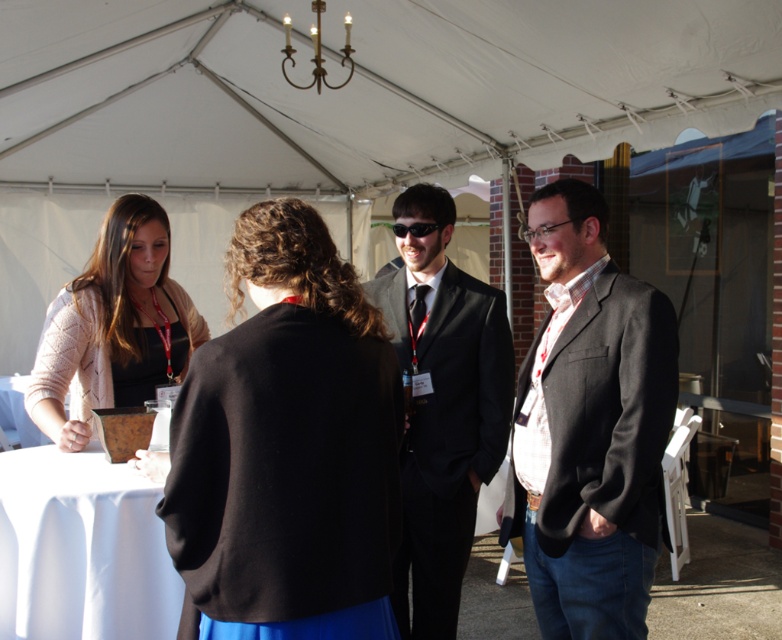
Where is `white cloth at lower left`? The height and width of the screenshot is (640, 782). white cloth at lower left is located at coordinates (81, 548).

Who is more distant from viewer, (92, 525) or (70, 320)?

The point (70, 320) is more distant.

In order to click on white cloth at lower left in this screenshot , I will do `click(81, 548)`.

Does black wool coat at center appear under matte black suit at center?

No, black wool coat at center is not below matte black suit at center.

The image size is (782, 640). Find the location of `black wool coat at center`. black wool coat at center is located at coordinates (285, 440).

Locate an element on the screen. Image resolution: width=782 pixels, height=640 pixels. black wool coat at center is located at coordinates (285, 440).

What do you see at coordinates (589, 426) in the screenshot? I see `matte black suit at center` at bounding box center [589, 426].

How much distance is there between matte black suit at center and black plastic sunglasses at center?

matte black suit at center is 33.72 inches from black plastic sunglasses at center.

The width and height of the screenshot is (782, 640). In order to click on matte black suit at center in this screenshot , I will do `click(589, 426)`.